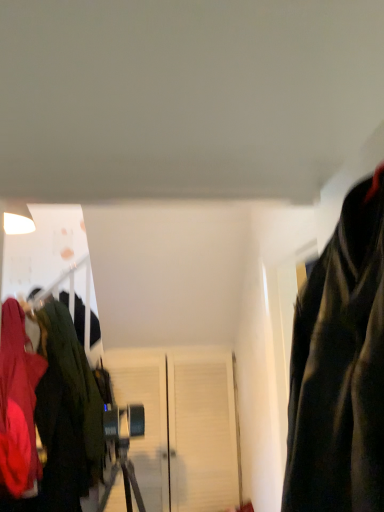
Question: Is white matte door at center wider or thinner than matte red jacket at left, which is counted as the first jacket, starting from the front?

Choices:
 (A) wide
 (B) thin

Answer: (B)

Question: Is white matte door at center in front of or behind matte red jacket at left, which is the 2th jacket in back-to-front order, in the image?

Choices:
 (A) front
 (B) behind

Answer: (B)

Question: Based on their relative distances, which object is farther from the velvet green jacket at left, which is counted as the first jacket, starting from the back?

Choices:
 (A) matte red jacket at left, which is counted as the first jacket, starting from the front
 (B) white matte door at center

Answer: (B)

Question: Based on their relative distances, which object is farther from the matte red jacket at left, which is counted as the first jacket, starting from the front?

Choices:
 (A) velvet green jacket at left, which is counted as the first jacket, starting from the back
 (B) white matte door at center

Answer: (B)